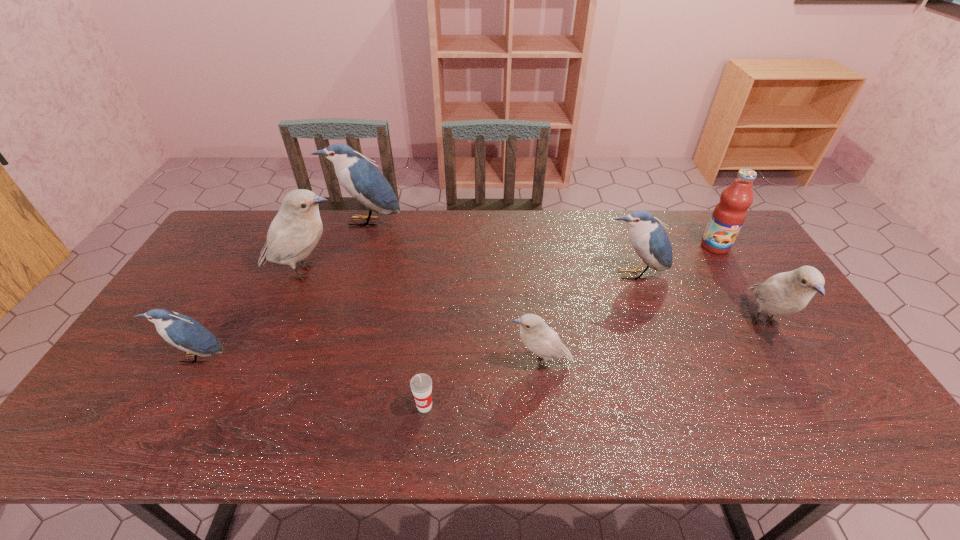
Identify which blue bird is located as the second nearest to the nearest blue bird. Please provide its 2D coordinates. Your answer should be formatted as a tuple, i.e. [(x, y)], where the tuple contains the x and y coordinates of a point satisfying the conditions above.

[(649, 239)]

You are a GUI agent. You are given a task and a screenshot of the screen. Output one action in this format:
    pyautogui.click(x=<x>, y=<y>)
    Task: Click on the closest white bird to the second white bird from right to left
    
    Given the screenshot: What is the action you would take?
    pyautogui.click(x=786, y=293)

Find the location of a particular element. white bird that stands as the third closest to the sixth object from left to right is located at coordinates (293, 234).